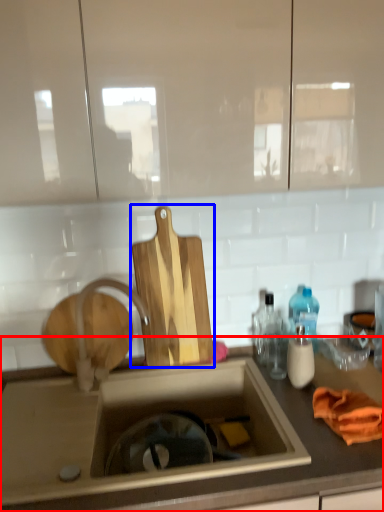
Question: Among these objects, which one is farthest to the camera, countertop (highlighted by a red box) or cutting board (highlighted by a blue box)?

Choices:
 (A) countertop
 (B) cutting board

Answer: (B)